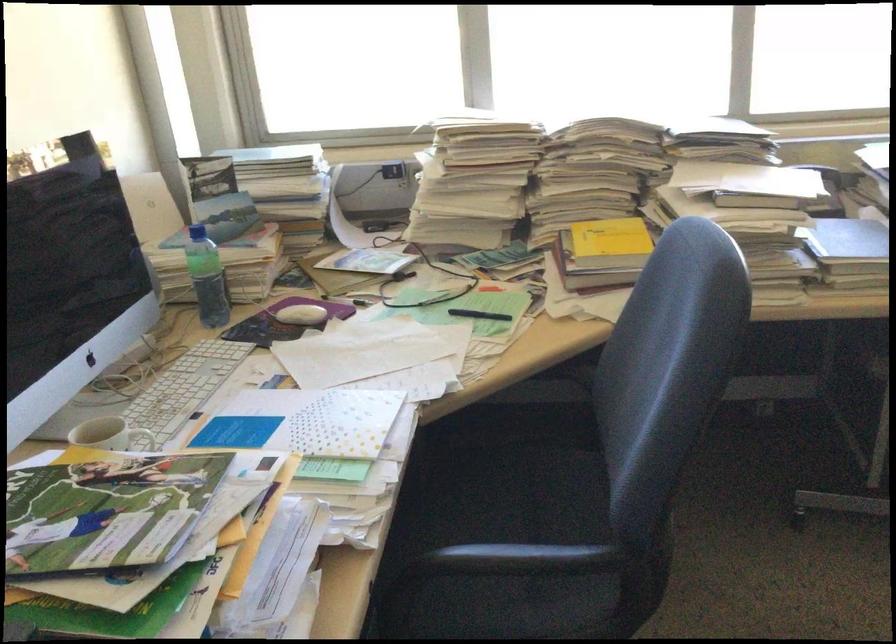
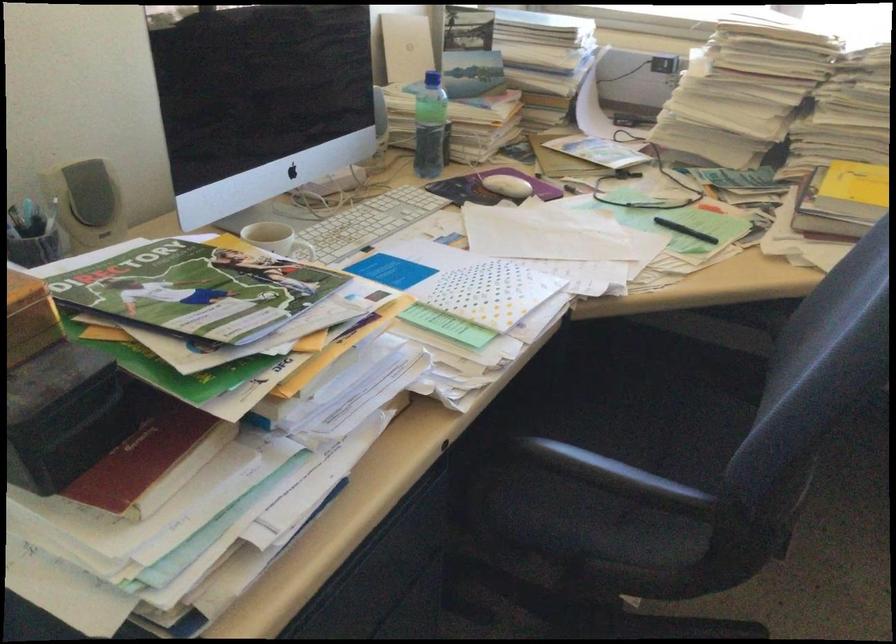
In the second image, find the point that corresponds to (x=510, y=486) in the first image.

(653, 411)